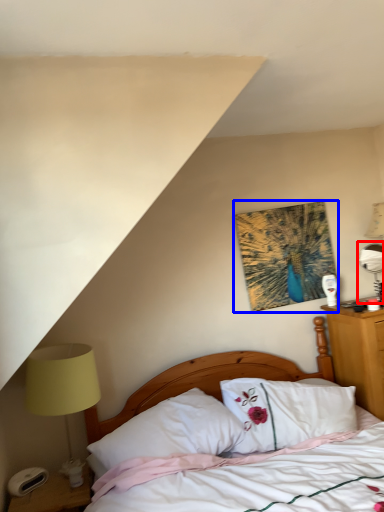
Question: Which object is further to the camera taking this photo, table lamp (highlighted by a red box) or picture frame (highlighted by a blue box)?

Choices:
 (A) table lamp
 (B) picture frame

Answer: (A)